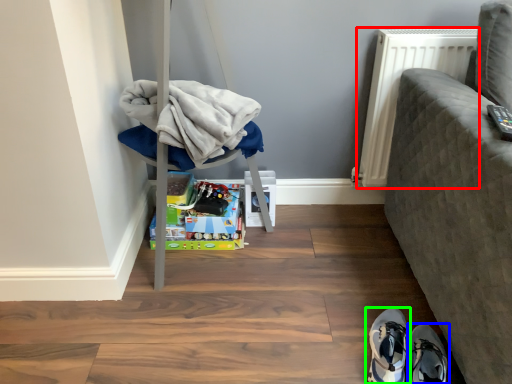
Question: Estimate the real-world distances between objects in this image. Which object is closer to radiator (highlighted by a red box), footwear (highlighted by a blue box) or footwear (highlighted by a green box)?

Choices:
 (A) footwear
 (B) footwear

Answer: (B)